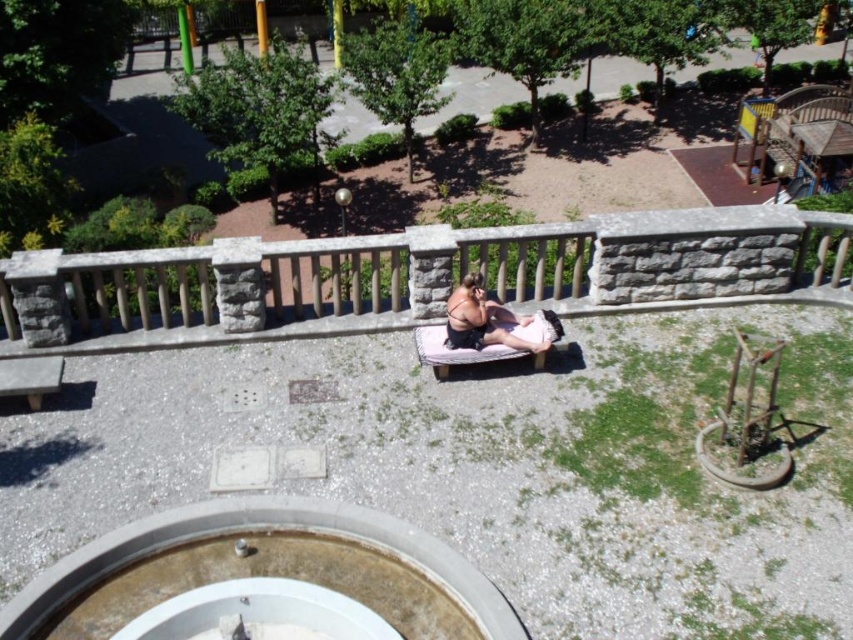
In the scene shown: You are standing on a balcony and want to place a small potted plant exactly at the point marked by coordinates point (421,276). Based on the scene description, where would this point be located?

The point (421,276) corresponds to the stone balustrade at center, so placing the potted plant there would mean it sits on the stone balustrade at center.

You are standing on a balcony and want to place a small potted plant on the dark pink fabric at center. However, there is a stone balustrade at center above it. Will the potted plant be in direct sunlight or shade?

The stone balustrade at center is located above the dark pink fabric at center. Since the balustrade is overhead, it will cast a shadow over the dark pink fabric at center, so the potted plant placed there would be in shade.